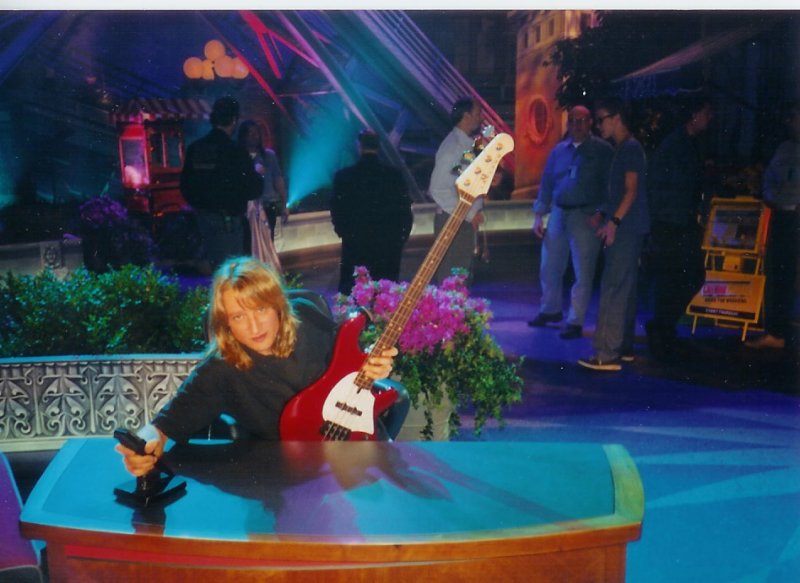
Identify the location of wooden desk edge. The width and height of the screenshot is (800, 583). (378, 550).